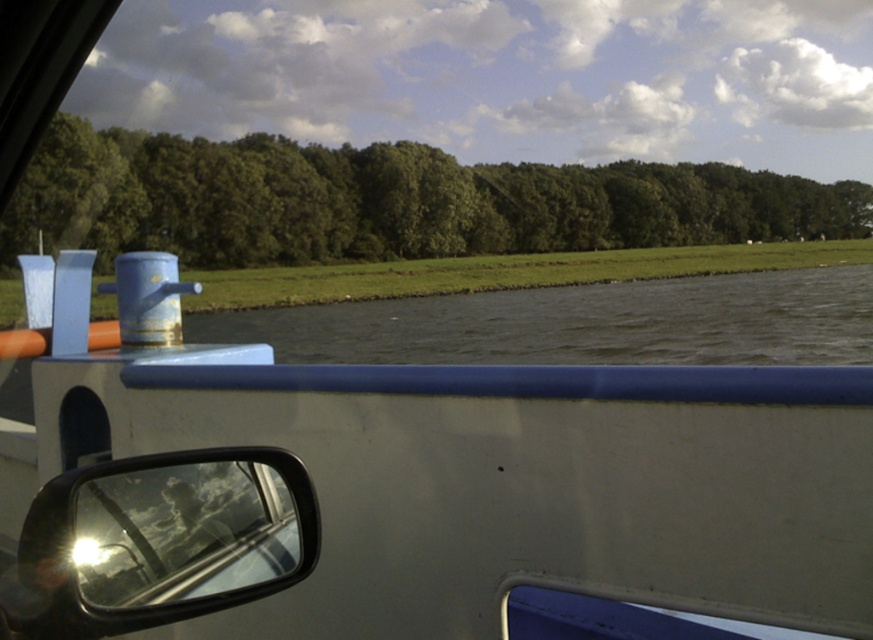
Question: Which point is closer to the camera taking this photo?

Choices:
 (A) (193, 477)
 (B) (411, 550)

Answer: (A)

Question: Is white matte boat at center below glossy plastic view mirror at lower left?

Choices:
 (A) no
 (B) yes

Answer: (B)

Question: Considering the real-world distances, which object is closest to the green leafy trees at upper center?

Choices:
 (A) white matte boat at center
 (B) glossy plastic view mirror at lower left

Answer: (A)

Question: Can you confirm if green leafy trees at upper center is bigger than glossy plastic view mirror at lower left?

Choices:
 (A) no
 (B) yes

Answer: (B)

Question: Which point is farther to the camera?

Choices:
 (A) (173, 481)
 (B) (510, 232)
 (C) (469, 545)

Answer: (B)

Question: Can you confirm if white matte boat at center is smaller than green leafy trees at upper center?

Choices:
 (A) yes
 (B) no

Answer: (A)